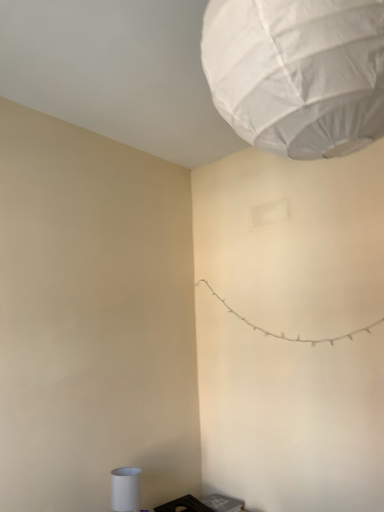
Question: Is white fabric lantern at upper center oriented away from black plastic laptop at lower right?

Choices:
 (A) yes
 (B) no

Answer: (B)

Question: From the image's perspective, is white fabric lantern at upper center below black plastic laptop at lower right?

Choices:
 (A) yes
 (B) no

Answer: (B)

Question: Does white fabric lantern at upper center have a lesser height compared to black plastic laptop at lower right?

Choices:
 (A) yes
 (B) no

Answer: (B)

Question: Is black plastic laptop at lower right completely or partially inside white fabric lantern at upper center?

Choices:
 (A) yes
 (B) no

Answer: (B)

Question: Considering the relative sizes of white fabric lantern at upper center and black plastic laptop at lower right in the image provided, is white fabric lantern at upper center taller than black plastic laptop at lower right?

Choices:
 (A) no
 (B) yes

Answer: (B)

Question: Looking at the image, does white fabric lantern at upper center seem bigger or smaller compared to white matte cylinder at lower left?

Choices:
 (A) big
 (B) small

Answer: (A)

Question: Is white fabric lantern at upper center in front of or behind white matte cylinder at lower left in the image?

Choices:
 (A) front
 (B) behind

Answer: (A)

Question: Is point (256, 122) positioned closer to the camera than point (130, 503)?

Choices:
 (A) farther
 (B) closer

Answer: (B)

Question: Would you say white fabric lantern at upper center is to the left or to the right of white matte cylinder at lower left in the picture?

Choices:
 (A) right
 (B) left

Answer: (A)

Question: Is black plastic laptop at lower right in front of or behind white matte cylinder at lower left in the image?

Choices:
 (A) front
 (B) behind

Answer: (B)

Question: From a real-world perspective, is black plastic laptop at lower right above or below white matte cylinder at lower left?

Choices:
 (A) above
 (B) below

Answer: (B)

Question: In terms of size, does black plastic laptop at lower right appear bigger or smaller than white matte cylinder at lower left?

Choices:
 (A) small
 (B) big

Answer: (B)

Question: Considering the positions of point (182, 502) and point (122, 471), is point (182, 502) closer or farther from the camera than point (122, 471)?

Choices:
 (A) farther
 (B) closer

Answer: (A)

Question: Considering the positions of black plastic laptop at lower right and white fabric lantern at upper center in the image, is black plastic laptop at lower right wider or thinner than white fabric lantern at upper center?

Choices:
 (A) thin
 (B) wide

Answer: (A)

Question: Considering the positions of black plastic laptop at lower right and white fabric lantern at upper center in the image, is black plastic laptop at lower right bigger or smaller than white fabric lantern at upper center?

Choices:
 (A) small
 (B) big

Answer: (A)